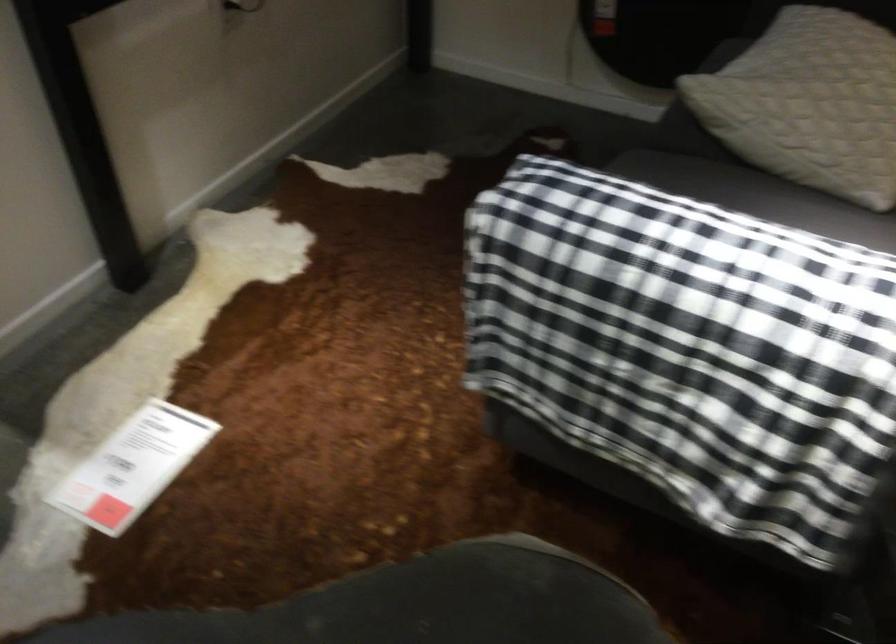
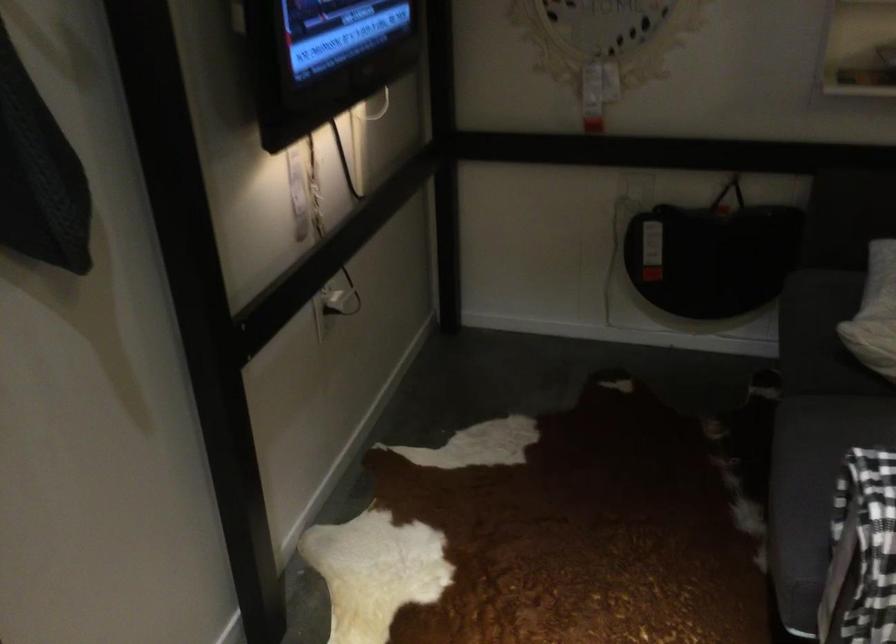
Question: What movement of the cameraman would produce the second image?

Choices:
 (A) Left
 (B) Right
 (C) Forward
 (D) Backward

Answer: (A)